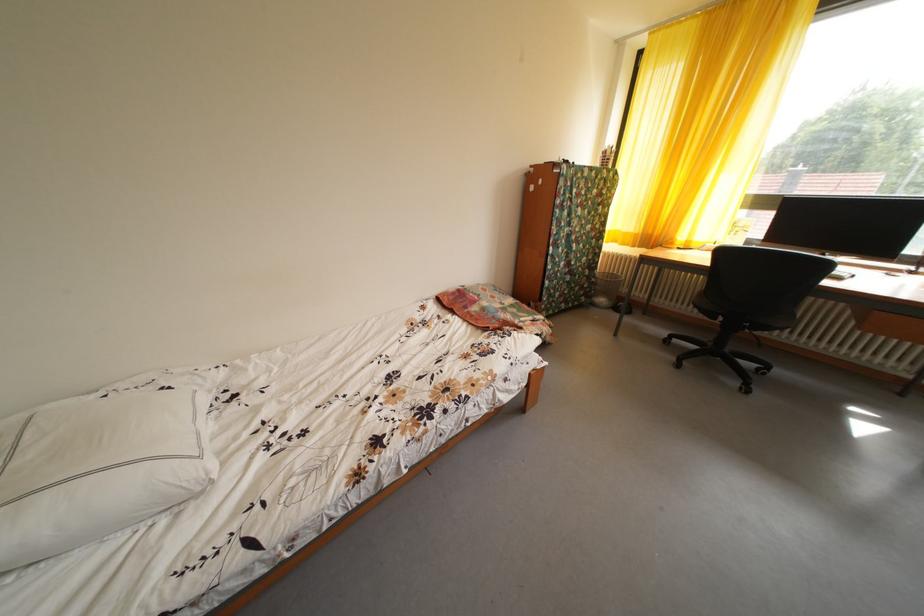
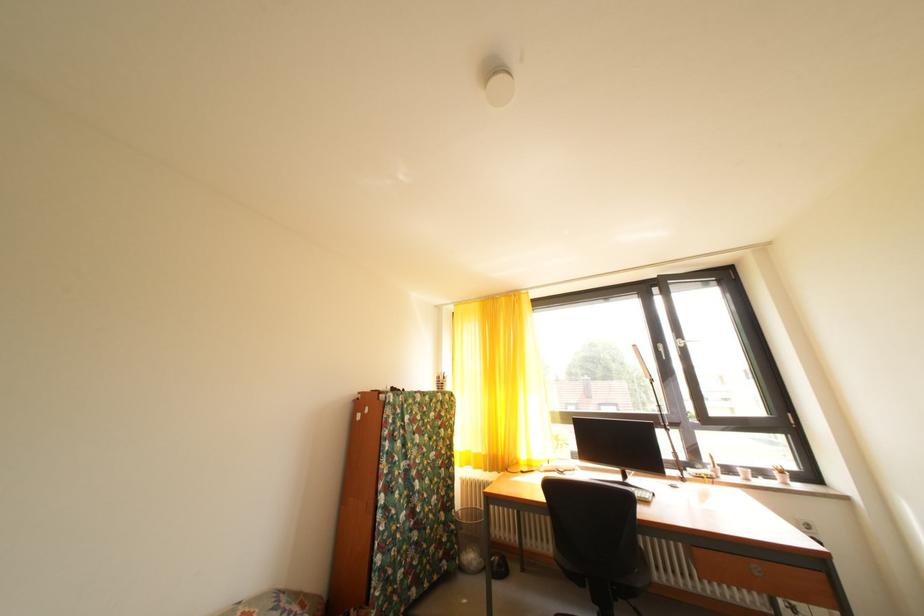
Find the pixel in the second image that matches [602,286] in the first image.

(462, 533)